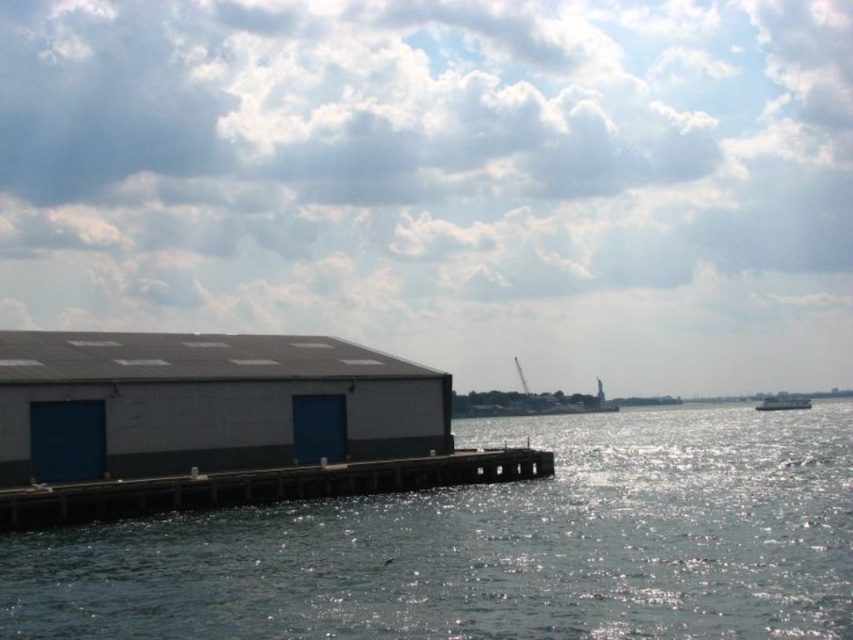
Does glistening water at dock center have a lesser height compared to gray metallic building at left?

Incorrect, glistening water at dock center's height does not fall short of gray metallic building at left's.

You are a GUI agent. You are given a task and a screenshot of the screen. Output one action in this format:
    pyautogui.click(x=<x>, y=<y>)
    Task: Click on the glistening water at dock center
    The image size is (853, 640).
    Given the screenshot: What is the action you would take?
    pyautogui.click(x=492, y=547)

Where is `glistening water at dock center`? The image size is (853, 640). glistening water at dock center is located at coordinates (492, 547).

Between glistening water at dock center and smooth wooden dock at center, which one has more height?

glistening water at dock center

Is point (157, 577) behind point (35, 518)?

No, it is not.

Image resolution: width=853 pixels, height=640 pixels. I want to click on glistening water at dock center, so click(x=492, y=547).

Is smooth wooden dock at center positioned before white glossy boat at right?

That is True.

Can you confirm if smooth wooden dock at center is positioned below white glossy boat at right?

No.

Who is more forward, (354, 496) or (782, 406)?

Point (354, 496)

Find the location of a particular element. The width and height of the screenshot is (853, 640). smooth wooden dock at center is located at coordinates (262, 486).